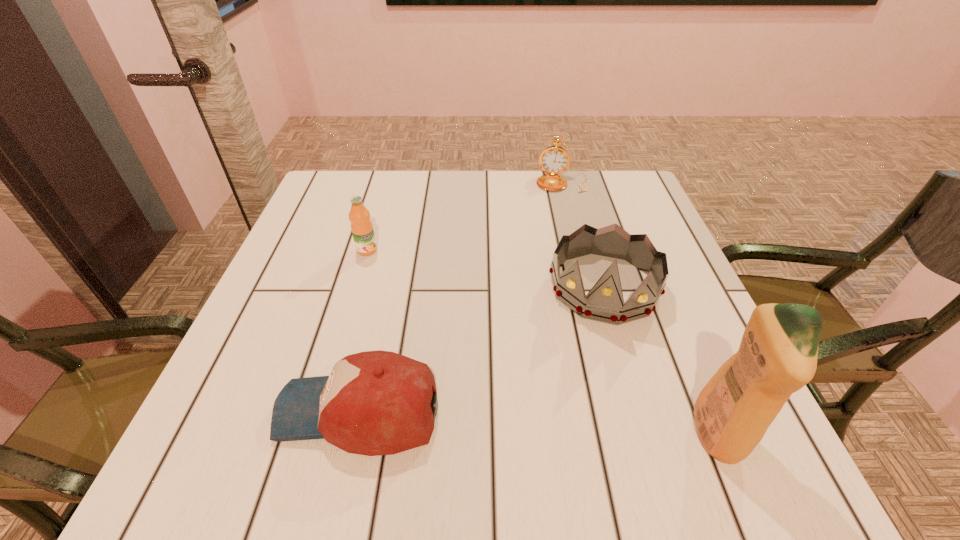
Where is `free space that is in between the tallest object and the orange juice`? The image size is (960, 540). free space that is in between the tallest object and the orange juice is located at coordinates (541, 343).

I want to click on object that is the third closest to the tiara, so click(x=554, y=160).

You are a GUI agent. You are given a task and a screenshot of the screen. Output one action in this format:
    pyautogui.click(x=<x>, y=<y>)
    Task: Click on the third closest object to the detergent
    This screenshot has height=540, width=960.
    Given the screenshot: What is the action you would take?
    pyautogui.click(x=554, y=160)

Find the location of a particular element. free space that satisfies the following two spatial constraints: 1. on the front side of the baseball cap; 2. on the front-facing side of the orange juice is located at coordinates (320, 411).

You are a GUI agent. You are given a task and a screenshot of the screen. Output one action in this format:
    pyautogui.click(x=<x>, y=<y>)
    Task: Click on the free location that satisfies the following two spatial constraints: 1. on the front side of the tiara; 2. on the right side of the pocket watch
    This screenshot has width=960, height=540.
    Given the screenshot: What is the action you would take?
    pyautogui.click(x=589, y=286)

Where is `vacant region that satisfies the following two spatial constraints: 1. on the front side of the orange juice; 2. on the label of the tallest object`? The height and width of the screenshot is (540, 960). vacant region that satisfies the following two spatial constraints: 1. on the front side of the orange juice; 2. on the label of the tallest object is located at coordinates (313, 435).